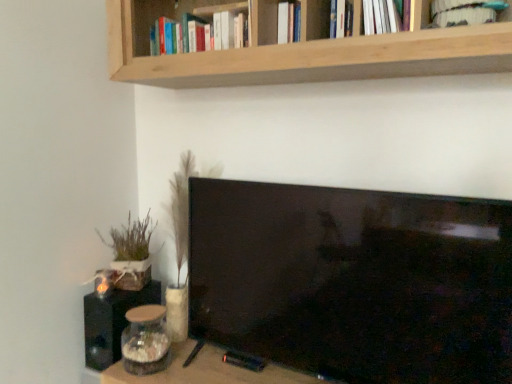
Where is `white fabric book at upper right, marked as the first book in a front-to-back arrangement`? The image size is (512, 384). white fabric book at upper right, marked as the first book in a front-to-back arrangement is located at coordinates (464, 12).

Identify the location of natural wood shelf at upper center. The image size is (512, 384). (298, 47).

The width and height of the screenshot is (512, 384). Describe the element at coordinates (298, 47) in the screenshot. I see `natural wood shelf at upper center` at that location.

Identify the location of white fabric book at upper right, marked as the first book in a front-to-back arrangement. (464, 12).

Can you confirm if natural wood shelf at upper center is positioned to the right of wooden box at left?

Yes.

Would you say natural wood shelf at upper center is a long distance from wooden box at left?

Actually, natural wood shelf at upper center and wooden box at left are a little close together.

From the image's perspective, would you say natural wood shelf at upper center is positioned over wooden box at left?

Yes, from the image's perspective, natural wood shelf at upper center is over wooden box at left.

Considering the positions of points (439, 4) and (115, 378), is point (439, 4) farther from camera compared to point (115, 378)?

No, (439, 4) is in front of (115, 378).

Is wooden table at lower center surrounded by white fabric book at upper right, placed as the second book when sorted from back to front?

No, wooden table at lower center is not a part of white fabric book at upper right, placed as the second book when sorted from back to front.

Could you measure the distance between white fabric book at upper right, which is the second book in left-to-right order, and wooden table at lower center?

The distance of white fabric book at upper right, which is the second book in left-to-right order, from wooden table at lower center is 4.30 feet.

Does white fabric book at upper right, placed as the second book when sorted from back to front, have a lesser height compared to wooden table at lower center?

Yes.

Considering the relative sizes of wooden box at left and white fabric book at upper right, which is the second book in left-to-right order, in the image provided, is wooden box at left taller than white fabric book at upper right, which is the second book in left-to-right order,?

Correct, wooden box at left is much taller as white fabric book at upper right, which is the second book in left-to-right order.

Considering the sizes of objects wooden box at left and white fabric book at upper right, which is the second book in left-to-right order, in the image provided, who is smaller, wooden box at left or white fabric book at upper right, which is the second book in left-to-right order,?

white fabric book at upper right, which is the second book in left-to-right order, is smaller.

Between point (140, 231) and point (457, 1), which one is positioned behind?

The point (140, 231) is farther.

Is there a large distance between wooden box at left and white fabric book at upper right, placed as the second book when sorted from back to front?

Yes, wooden box at left and white fabric book at upper right, placed as the second book when sorted from back to front, are located far from each other.

Considering the sizes of objects black matte speaker at lower left and hardcover books at upper center, the 1th book when ordered from back to front, in the image provided, who is smaller, black matte speaker at lower left or hardcover books at upper center, the 1th book when ordered from back to front,?

black matte speaker at lower left.

How far apart are black matte speaker at lower left and hardcover books at upper center, the 1th book when ordered from back to front?

black matte speaker at lower left is 1.07 meters from hardcover books at upper center, the 1th book when ordered from back to front.

Would you say black matte speaker at lower left is outside hardcover books at upper center, which is counted as the 2th book, starting from the right?

That's correct, black matte speaker at lower left is outside of hardcover books at upper center, which is counted as the 2th book, starting from the right.

Which object is more forward, black matte speaker at lower left or hardcover books at upper center, the 1th book when ordered from back to front?

hardcover books at upper center, the 1th book when ordered from back to front, is more forward.

Which object is positioned more to the right, natural wood shelf at upper center or hardcover books at upper center, the first book positioned from the left?

natural wood shelf at upper center.

From the image's perspective, is natural wood shelf at upper center over hardcover books at upper center, the first book positioned from the left?

No, from the image's perspective, natural wood shelf at upper center is not on top of hardcover books at upper center, the first book positioned from the left.

At what (x,y) coordinates should I click in order to perform the action: click on shelf that is below the hardcover books at upper center, the first book positioned from the left (from the image's perspective). Please return your answer as a coordinate pair (x, y). This screenshot has width=512, height=384. Looking at the image, I should click on (298, 47).

Do you think hardcover books at upper center, the 1th book when ordered from back to front, is within white fabric book at upper right, which is the second book in left-to-right order, or outside of it?

hardcover books at upper center, the 1th book when ordered from back to front, is outside white fabric book at upper right, which is the second book in left-to-right order.

Consider the image. Does hardcover books at upper center, the 2th book when ordered from front to back, have a lesser width compared to white fabric book at upper right, which is the second book in left-to-right order?

In fact, hardcover books at upper center, the 2th book when ordered from front to back, might be wider than white fabric book at upper right, which is the second book in left-to-right order.

Considering the sizes of objects hardcover books at upper center, the 2th book when ordered from front to back, and white fabric book at upper right, which is the second book in left-to-right order, in the image provided, who is smaller, hardcover books at upper center, the 2th book when ordered from front to back, or white fabric book at upper right, which is the second book in left-to-right order,?

white fabric book at upper right, which is the second book in left-to-right order.

Between hardcover books at upper center, the first book positioned from the left, and white fabric book at upper right, marked as the first book in a front-to-back arrangement, which one appears on the right side from the viewer's perspective?

white fabric book at upper right, marked as the first book in a front-to-back arrangement.

Could you tell me if wooden table at lower center is turned towards hardcover books at upper center, the 1th book when ordered from back to front?

No, wooden table at lower center is not aimed at hardcover books at upper center, the 1th book when ordered from back to front.

Considering the relative sizes of wooden table at lower center and hardcover books at upper center, which is counted as the 2th book, starting from the right, in the image provided, is wooden table at lower center taller than hardcover books at upper center, which is counted as the 2th book, starting from the right,?

A: Indeed, wooden table at lower center has a greater height compared to hardcover books at upper center, which is counted as the 2th book, starting from the right.

In the scene shown: Between wooden table at lower center and hardcover books at upper center, which is counted as the 2th book, starting from the right, which one has smaller width?

Thinner between the two is hardcover books at upper center, which is counted as the 2th book, starting from the right.

Does wooden table at lower center touch hardcover books at upper center, which is counted as the 2th book, starting from the right?

No, wooden table at lower center is not next to hardcover books at upper center, which is counted as the 2th book, starting from the right.

What are the coordinates of `shelf above the wooden box at left (from the image's perspective)` in the screenshot? It's located at (298, 47).

You are a GUI agent. You are given a task and a screenshot of the screen. Output one action in this format:
    pyautogui.click(x=<x>, y=<y>)
    Task: Click on the book that is the 1st one above the wooden table at lower center (from a real-world perspective)
    The width and height of the screenshot is (512, 384).
    Given the screenshot: What is the action you would take?
    pyautogui.click(x=464, y=12)

Considering their positions, is hardcover books at upper center, which is counted as the 2th book, starting from the right, positioned closer to white fabric book at upper right, which is the second book in left-to-right order, than black matte speaker at lower left?

Based on the image, hardcover books at upper center, which is counted as the 2th book, starting from the right, appears to be nearer to white fabric book at upper right, which is the second book in left-to-right order.

Estimate the real-world distances between objects in this image. Which object is closer to hardcover books at upper center, the 1th book when ordered from back to front, natural wood shelf at upper center or black matte speaker at lower left?

Based on the image, natural wood shelf at upper center appears to be nearer to hardcover books at upper center, the 1th book when ordered from back to front.

Estimate the real-world distances between objects in this image. Which object is closer to natural wood shelf at upper center, white fabric book at upper right, placed as the second book when sorted from back to front, or wooden table at lower center?

Among the two, white fabric book at upper right, placed as the second book when sorted from back to front, is located nearer to natural wood shelf at upper center.

Based on their spatial positions, is natural wood shelf at upper center or wooden table at lower center further from white fabric book at upper right, marked as the first book in a front-to-back arrangement?

Based on the image, wooden table at lower center appears to be further to white fabric book at upper right, marked as the first book in a front-to-back arrangement.

From the image, which object appears to be nearer to wooden table at lower center, wooden box at left or black matte speaker at lower left?

black matte speaker at lower left.

Based on their spatial positions, is wooden table at lower center or hardcover books at upper center, the first book positioned from the left, further from white fabric book at upper right, which is the second book in left-to-right order?

The object further to white fabric book at upper right, which is the second book in left-to-right order, is wooden table at lower center.

Based on their spatial positions, is wooden table at lower center or natural wood shelf at upper center closer to hardcover books at upper center, the first book positioned from the left?

natural wood shelf at upper center is closer to hardcover books at upper center, the first book positioned from the left.

Based on their spatial positions, is black matte speaker at lower left or natural wood shelf at upper center further from wooden table at lower center?

natural wood shelf at upper center.

Find the location of a particular element. The width and height of the screenshot is (512, 384). speaker that lies between white fabric book at upper right, marked as the first book in a front-to-back arrangement, and wooden table at lower center from top to bottom is located at coordinates (112, 322).

You are a GUI agent. You are given a task and a screenshot of the screen. Output one action in this format:
    pyautogui.click(x=<x>, y=<y>)
    Task: Click on the plant between white fabric book at upper right, the 1th book from the right, and wooden table at lower center, in the vertical direction
    The width and height of the screenshot is (512, 384).
    Given the screenshot: What is the action you would take?
    pyautogui.click(x=131, y=239)

I want to click on book between natural wood shelf at upper center and wooden table at lower center in the vertical direction, so click(464, 12).

Locate an element on the screen. Image resolution: width=512 pixels, height=384 pixels. shelf located between wooden box at left and white fabric book at upper right, the 1th book from the right, in the left-right direction is located at coordinates (298, 47).